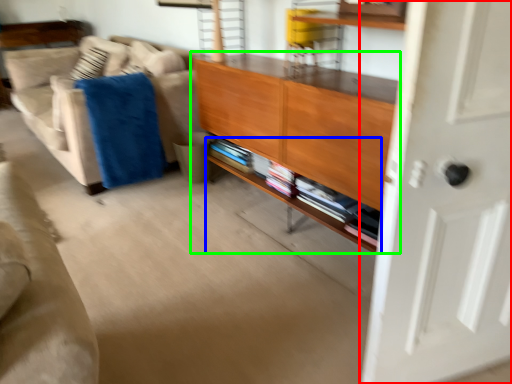
Question: Based on their relative distances, which object is nearer to door (highlighted by a red box)? Choose from shelf (highlighted by a blue box) and cabinetry (highlighted by a green box).

Choices:
 (A) shelf
 (B) cabinetry

Answer: (B)